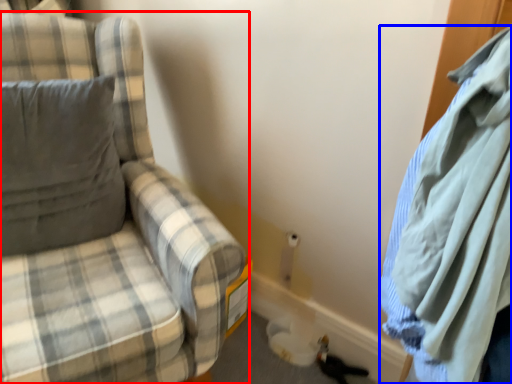
Question: Which point is further to the camera, chair (highlighted by a red box) or cloak (highlighted by a blue box)?

Choices:
 (A) chair
 (B) cloak

Answer: (A)